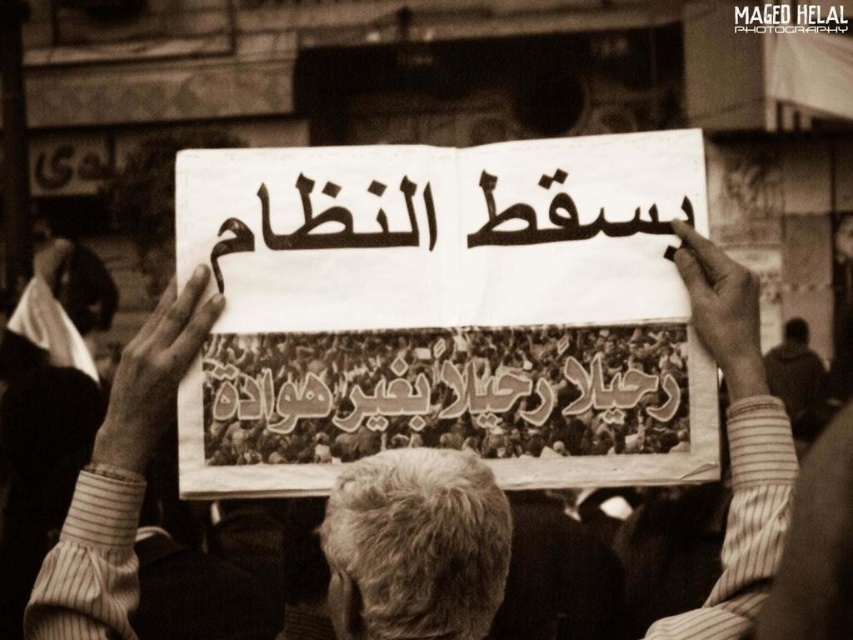
Consider the image. In the vintage protest scene, the white paper at center and striped shirt at center are both visible. Which object is wider?

The white paper at center is wider than the striped shirt at center.

In the vintage protest photo, you notice a white paper at center and a striped shirt at center. Which object is located more to the right?

The white paper at center is positioned more to the right than the striped shirt at center.